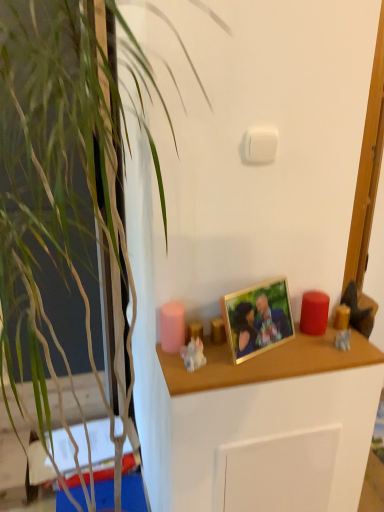
Find the location of a particular element. The image size is (384, 512). free space in front of translucent amber glass candle at right, which is the third candle from left to right is located at coordinates (339, 349).